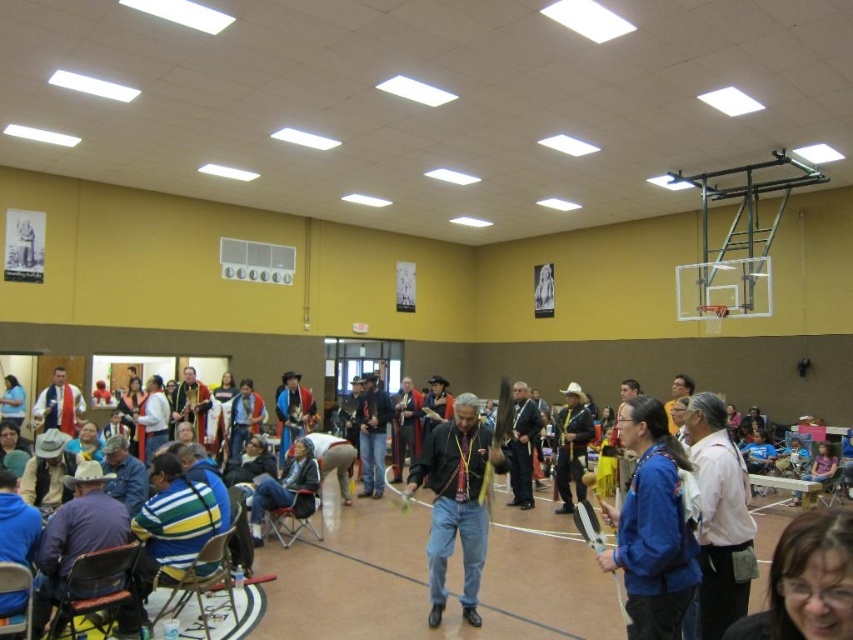
Question: Based on their relative distances, which object is nearer to the matte white robe at center?

Choices:
 (A) blue fabric jacket at center
 (B) blue striped shirt at center

Answer: (B)

Question: Is blue striped shirt at center to the left of dark gray suit at center from the viewer's perspective?

Choices:
 (A) yes
 (B) no

Answer: (A)

Question: Does blue striped shirt at center come in front of dark blue jacket at center?

Choices:
 (A) no
 (B) yes

Answer: (B)

Question: Is matte blue shirt at lower right smaller than matte white robe at center?

Choices:
 (A) yes
 (B) no

Answer: (A)

Question: Which of these objects is positioned farthest from the yellow fabric vest at center?

Choices:
 (A) blue fabric jacket at center
 (B) matte white robe at center
 (C) white cotton shirt at center

Answer: (B)

Question: Which of the following is the closest to the observer?

Choices:
 (A) (53, 417)
 (B) (309, 460)
 (C) (479, 554)
 (D) (364, 481)

Answer: (C)